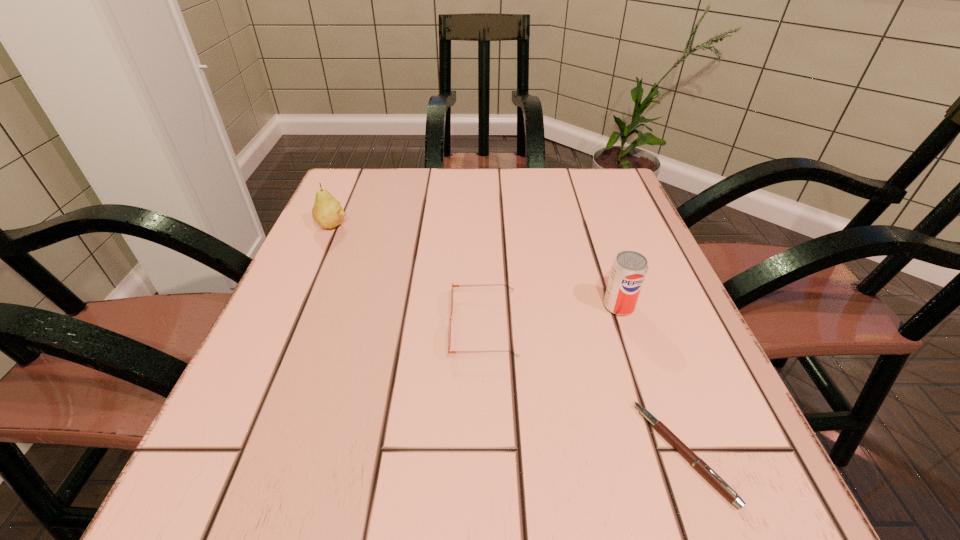
Choose which object is the nearest neighbor to the pear. Please provide its 2D coordinates. Your answer should be formatted as a tuple, i.e. [(x, y)], where the tuple contains the x and y coordinates of a point satisfying the conditions above.

[(449, 330)]